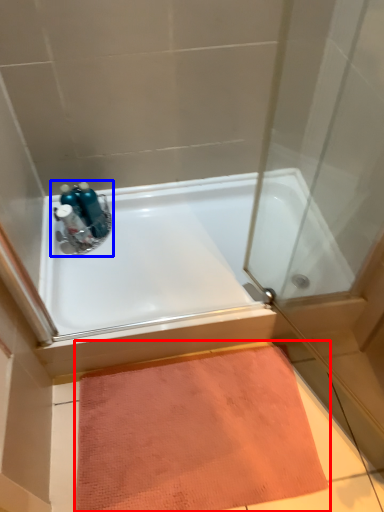
Question: Which object is further to the camera taking this photo, doormat (highlighted by a red box) or sink (highlighted by a blue box)?

Choices:
 (A) doormat
 (B) sink

Answer: (B)